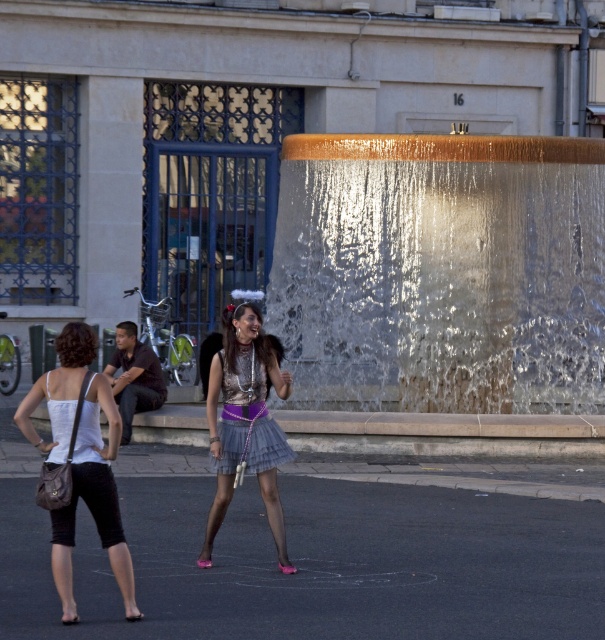
Question: Which point appears closest to the camera in this image?

Choices:
 (A) (275, 458)
 (B) (87, 355)
 (C) (73, 490)

Answer: (C)

Question: Is shiny metallic skirt at center further to camera compared to shiny purple fabric dress at center?

Choices:
 (A) no
 (B) yes

Answer: (A)

Question: Does white fabric dress at lower left appear over shiny purple fabric dress at center?

Choices:
 (A) yes
 (B) no

Answer: (B)

Question: Which object appears closest to the camera in this image?

Choices:
 (A) white fabric dress at lower left
 (B) translucent glass waterfall at center

Answer: (A)

Question: Can you confirm if translucent glass waterfall at center is positioned to the right of white fabric tank top at lower left?

Choices:
 (A) yes
 (B) no

Answer: (A)

Question: Considering the real-world distances, which object is farthest from the translucent glass waterfall at center?

Choices:
 (A) white fabric tank top at lower left
 (B) shiny metallic skirt at center

Answer: (A)